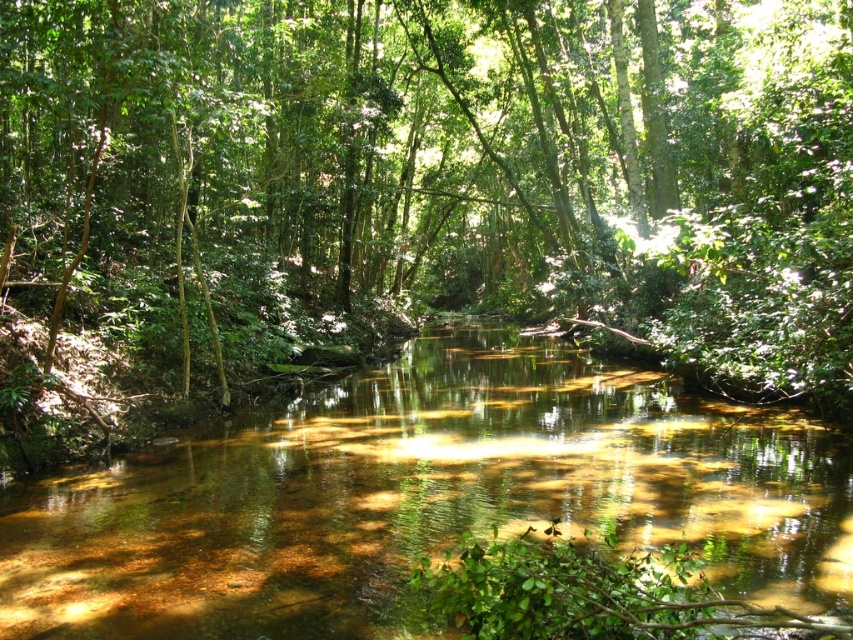
Does green leafy tree at center have a lesser width compared to translucent brown water at center?

No.

Between green leafy tree at center and translucent brown water at center, which one has more height?

With more height is green leafy tree at center.

Which is in front, point (334, 131) or point (335, 513)?

Point (335, 513)

I want to click on green leafy tree at center, so click(x=456, y=163).